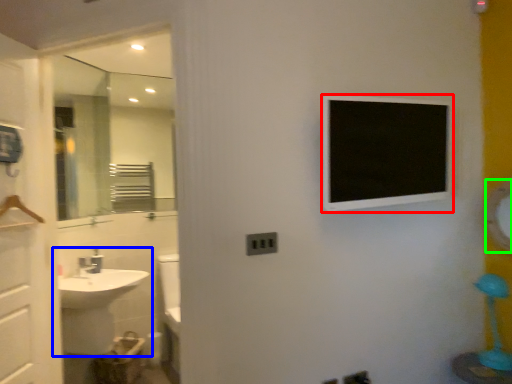
Question: Which is farther away from medicine cabinet (highlighted by a red box)? sink (highlighted by a blue box) or mirror (highlighted by a green box)?

Choices:
 (A) sink
 (B) mirror

Answer: (A)